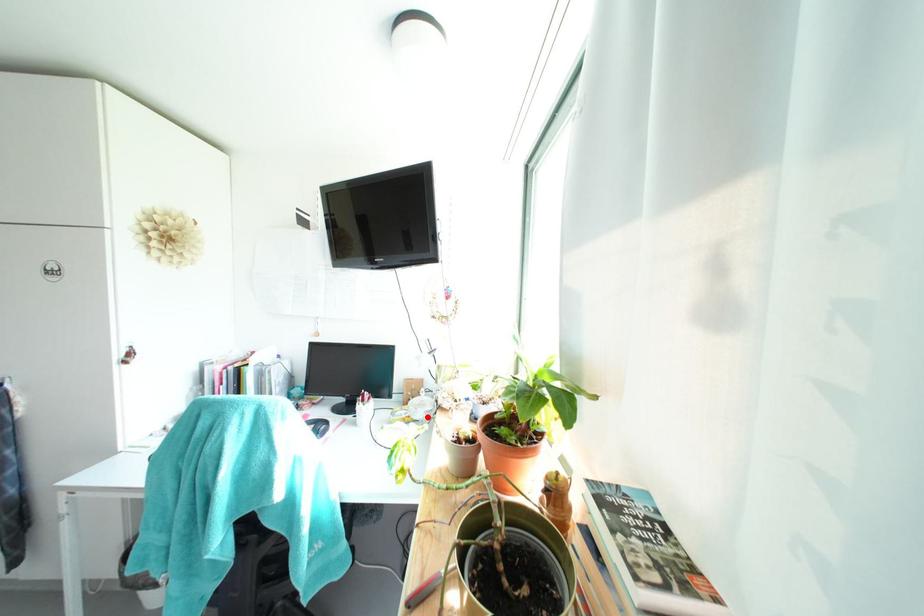
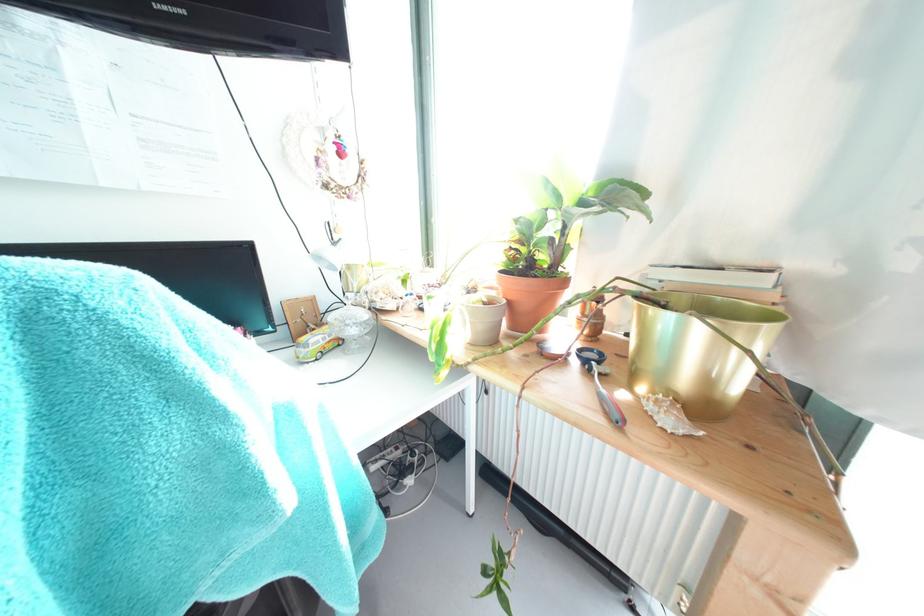
Locate, in the second image, the point that corresponds to the highlighted location in the first image.

(359, 333)